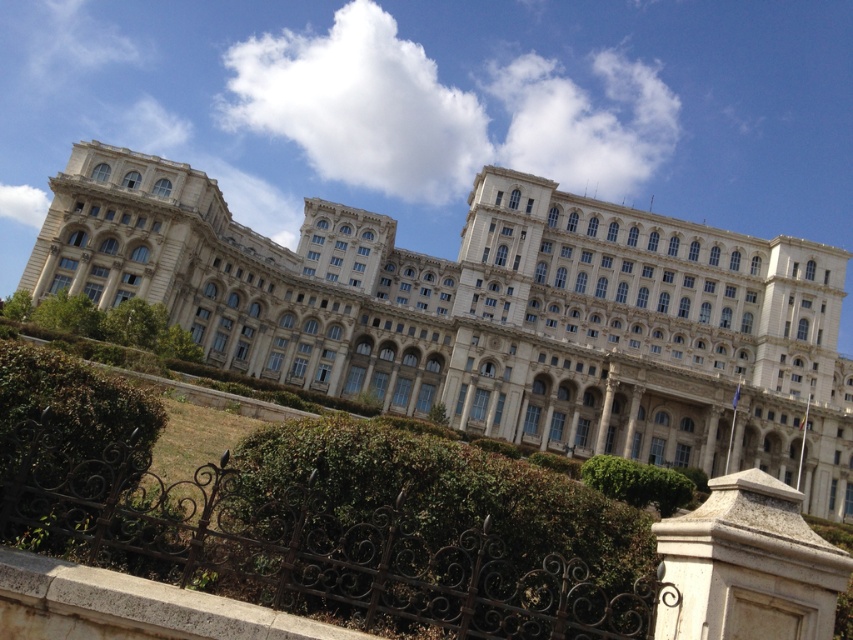
Who is more distant from viewer, (71, 184) or (636, 493)?

The point (71, 184) is behind.

Who is shorter, white stone building at center or green leafy hedge at center?

green leafy hedge at center is shorter.

Is point (154, 189) behind point (637, 477)?

Yes, point (154, 189) is farther from viewer.

Locate an element on the screen. The image size is (853, 640). white stone building at center is located at coordinates (x=489, y=314).

Where is `green leafy hedge at lower left`? The height and width of the screenshot is (640, 853). green leafy hedge at lower left is located at coordinates pyautogui.click(x=67, y=429).

Based on the photo, is green leafy hedge at lower left thinner than green leafy hedge at center?

Indeed, green leafy hedge at lower left has a lesser width compared to green leafy hedge at center.

The height and width of the screenshot is (640, 853). Describe the element at coordinates (67, 429) in the screenshot. I see `green leafy hedge at lower left` at that location.

Where is `green leafy hedge at lower left`? This screenshot has height=640, width=853. green leafy hedge at lower left is located at coordinates (67, 429).

Consider the image. Who is lower down, white stone building at center or green leafy hedge at lower left?

green leafy hedge at lower left is lower down.

Which is in front, point (265, 259) or point (33, 365)?

Positioned in front is point (33, 365).

At what (x,y) coordinates should I click in order to perform the action: click on white stone building at center. Please return your answer as a coordinate pair (x, y). This screenshot has height=640, width=853. Looking at the image, I should click on (489, 314).